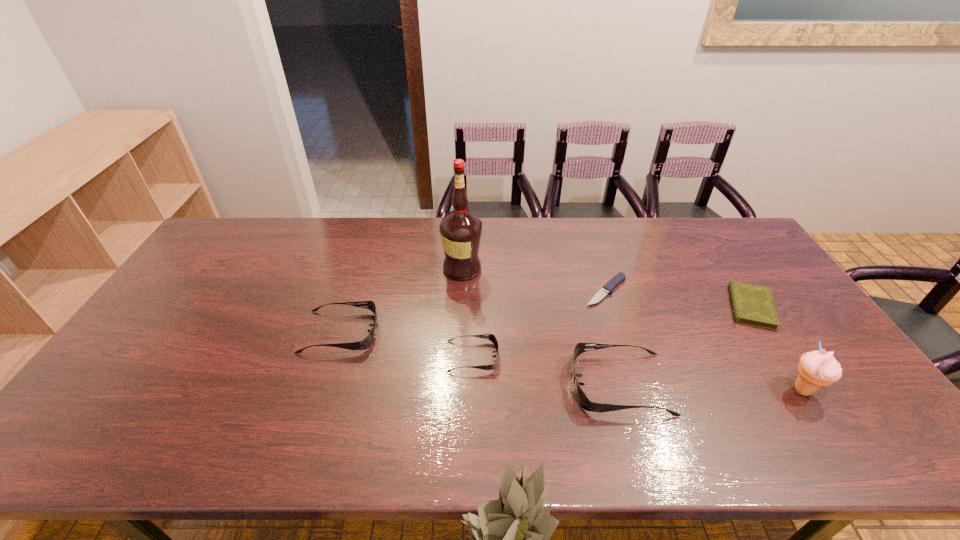
Identify the location of vacant space located 0.230m on the front-facing side of the third shortest object. This screenshot has width=960, height=540. click(584, 356).

I want to click on free space located 0.140m on the front-facing side of the rightmost sunglasses, so click(x=516, y=384).

This screenshot has height=540, width=960. I want to click on vacant region located 0.230m on the front-facing side of the rightmost sunglasses, so click(481, 384).

Locate an element on the screen. This screenshot has height=540, width=960. free location located 0.110m on the front-facing side of the rightmost sunglasses is located at coordinates (528, 384).

Find the location of `vacant position located on the label of the alcohol`. vacant position located on the label of the alcohol is located at coordinates (548, 269).

Image resolution: width=960 pixels, height=540 pixels. Find the location of `free space located on the front of the second shortest object`. free space located on the front of the second shortest object is located at coordinates (776, 345).

Find the location of `blank area located 0.390m on the back of the sixth shortest object`. blank area located 0.390m on the back of the sixth shortest object is located at coordinates (729, 277).

Where is `free spot located 0.120m on the right of the shortest object`? The width and height of the screenshot is (960, 540). free spot located 0.120m on the right of the shortest object is located at coordinates (667, 291).

Find the location of `object present at the far edge`. object present at the far edge is located at coordinates 460,230.

At what (x,y) coordinates should I click in order to perform the action: click on sunglasses at the near edge. Please return your answer as a coordinate pair (x, y). This screenshot has height=540, width=960. Looking at the image, I should click on (586, 404).